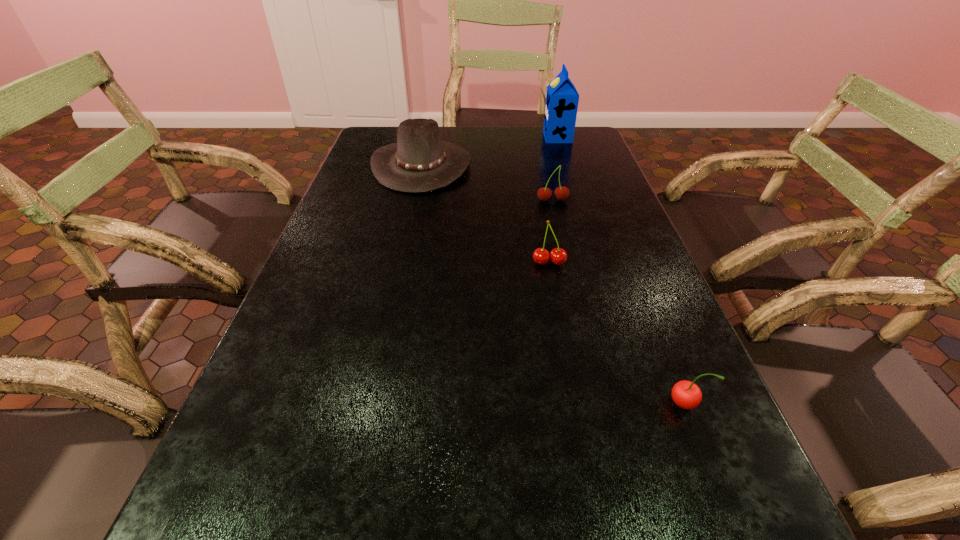
You are a GUI agent. You are given a task and a screenshot of the screen. Output one action in this format:
    pyautogui.click(x=<x>, y=<y>)
    Task: Click on the tallest object
    
    Given the screenshot: What is the action you would take?
    pyautogui.click(x=562, y=98)

Find the location of a particular element. This screenshot has height=540, width=960. the leftmost object is located at coordinates (420, 162).

Identify the location of the farthest cherry. The height and width of the screenshot is (540, 960). (561, 193).

The image size is (960, 540). Identify the location of the second nearest object. (558, 256).

This screenshot has width=960, height=540. In order to click on the nearest cherry in this screenshot , I will do `click(686, 394)`.

Locate an element on the screen. The width and height of the screenshot is (960, 540). the nearest object is located at coordinates (686, 394).

Find the location of a particular element. vacant region located with the cap open on the tallest object is located at coordinates (447, 138).

Where is `vacant space situated 0.350m with the cap open on the tallest object`? This screenshot has height=540, width=960. vacant space situated 0.350m with the cap open on the tallest object is located at coordinates (444, 138).

Locate an element on the screen. vacant space located with the cap open on the tallest object is located at coordinates (468, 138).

I want to click on free space located 0.290m on the front-facing side of the leftmost object, so click(x=563, y=165).